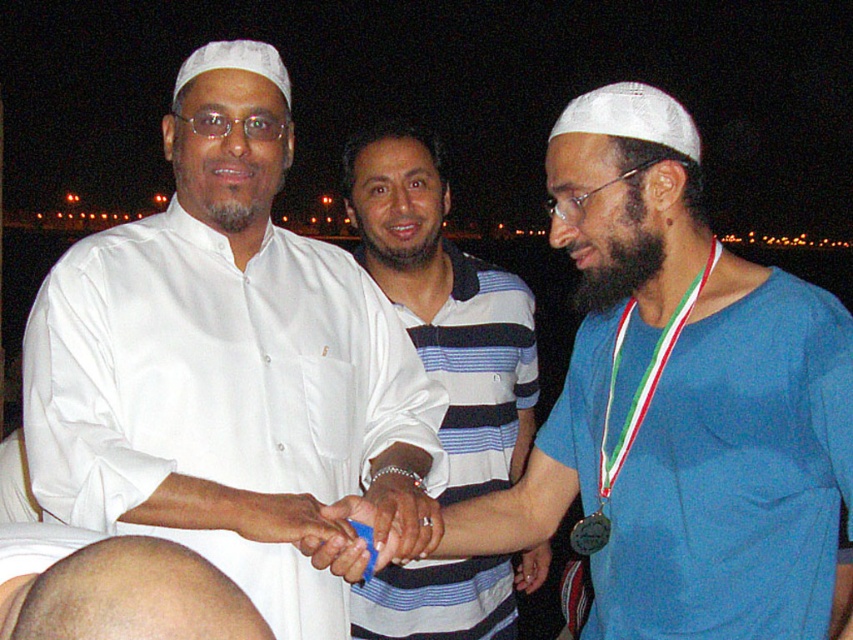
You are a photographer at the event and need to ensure the blue cotton shirt at right and the gold metallic medal at center are both visible in the photo. Given their sizes, which object should you focus on to ensure both are in frame without cropping?

The blue cotton shirt at right is larger than the gold metallic medal at center, so focusing on the blue cotton shirt at right will ensure both objects are visible without cropping.

You are a photographer at the event and need to capture a photo where both the blue cotton shirt at right and the matte silver ring at center are clearly visible. Based on their positions, which object should you focus on first to ensure both are in frame?

The blue cotton shirt at right is taller than the matte silver ring at center, so focusing on the blue cotton shirt at right first will ensure both are in frame as it occupies a larger space.

You are a photographer standing in front of the scene. You want to take a photo of the blue cotton shirt at right and the gold metallic medal at center. What is the minimum distance you need to move backward to ensure both are fully visible in your camera frame?

The blue cotton shirt at right and gold metallic medal at center are 27.38 centimeters apart. To capture both in the frame, you need to move back until the camera can cover at least 27.38 centimeters of the scene.